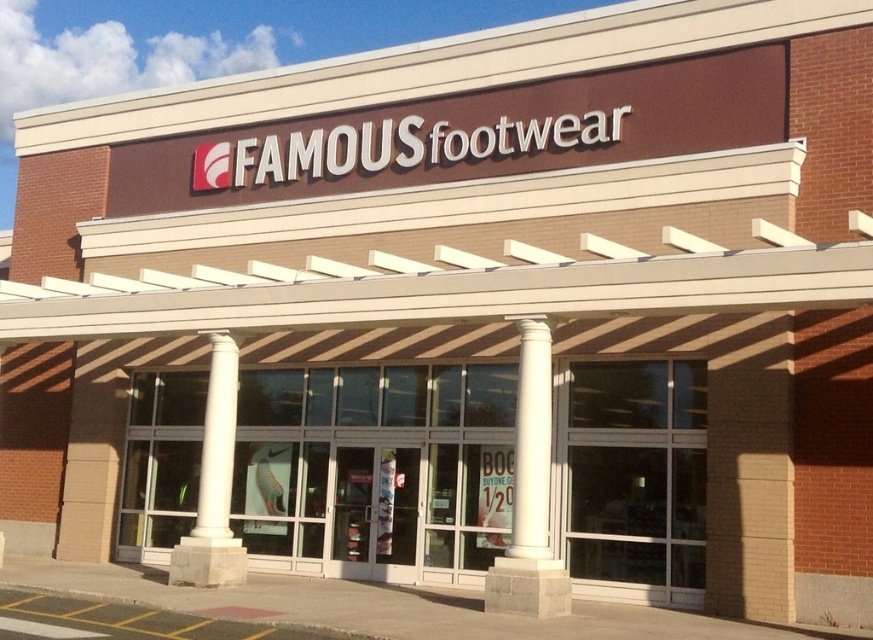
From the picture: Can you confirm if white concrete column at center is taller than white marble column at center?

Yes, white concrete column at center is taller than white marble column at center.

Between white concrete column at center and white marble column at center, which one is positioned lower?

white marble column at center is below.

Image resolution: width=873 pixels, height=640 pixels. Identify the location of white concrete column at center. (530, 493).